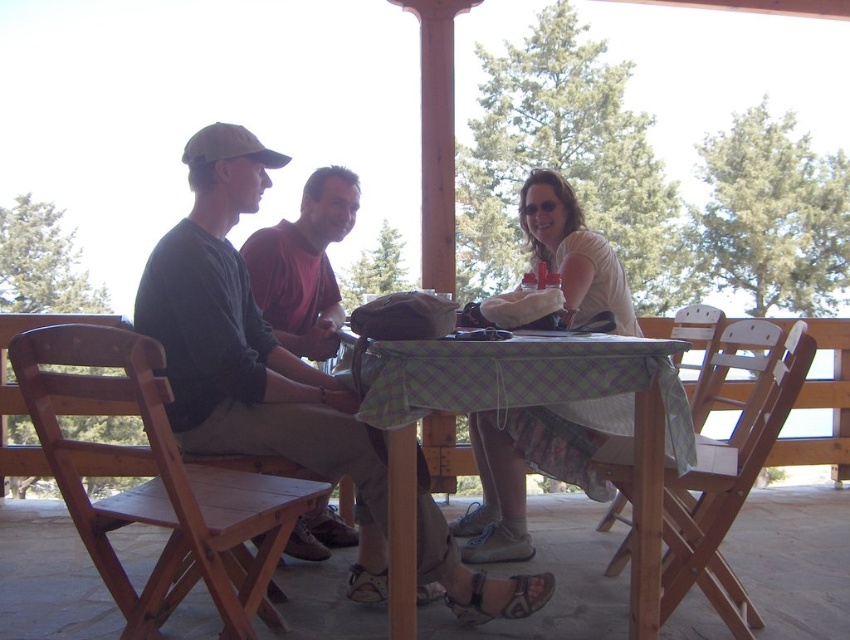
Question: Can you confirm if white cotton shirt at center is bigger than matte black shirt at center?

Choices:
 (A) no
 (B) yes

Answer: (B)

Question: Which point is farther to the camera?

Choices:
 (A) matte black shirt at left
 (B) white cotton shirt at center
 (C) checkered fabric table at center

Answer: (B)

Question: Is matte black shirt at left positioned in front of white cotton shirt at center?

Choices:
 (A) no
 (B) yes

Answer: (B)

Question: Observing the image, what is the correct spatial positioning of white cotton shirt at center in reference to matte black shirt at center?

Choices:
 (A) below
 (B) above

Answer: (A)

Question: Estimate the real-world distances between objects in this image. Which object is farther from the matte black shirt at center?

Choices:
 (A) checkered fabric table at center
 (B) white cotton shirt at center
 (C) matte black shirt at left

Answer: (A)

Question: Which point is farther from the camera taking this photo?

Choices:
 (A) (314, 372)
 (B) (275, 301)
 (C) (590, 317)
 (D) (391, 481)

Answer: (B)